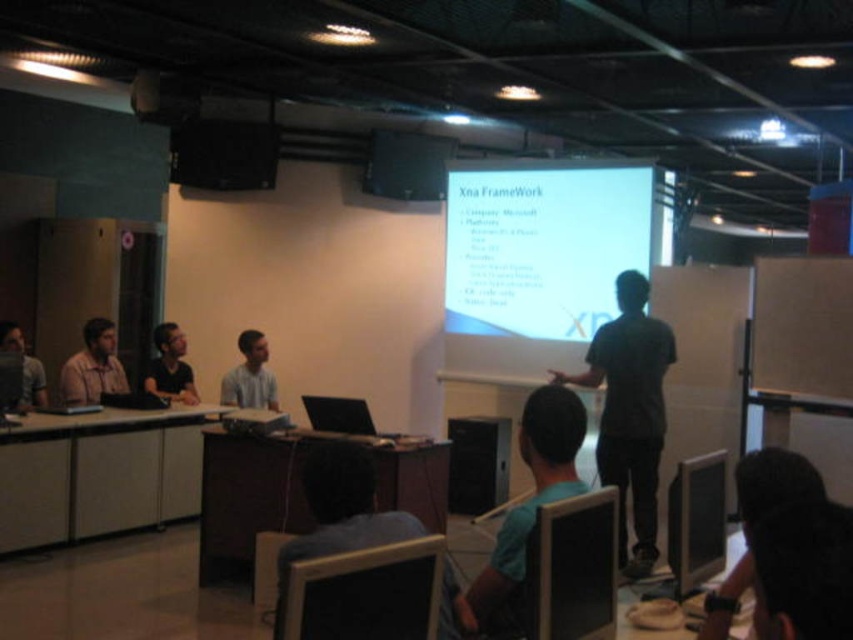
You are sitting at the back of the classroom and want to ask a question to the person wearing the blue shirt at center and the light gray shirt at center. Which one is closer to you?

The blue shirt at center is closer to the viewer than light gray shirt at center, so the blue shirt at center is closer to you.

You are a student sitting at the desk in the classroom. You need to check both the black plastic monitor at lower center and the black glossy monitor at lower right. Which monitor should you look up to first?

The black plastic monitor at lower center is above the black glossy monitor at lower right, so you should look up to the black plastic monitor at lower center first.